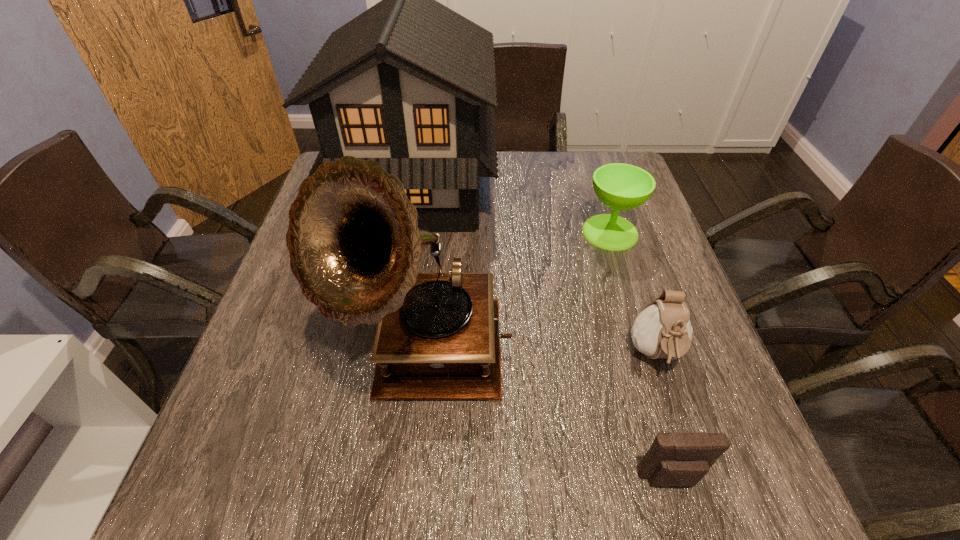
Identify which object is located as the nearest to the farther pouch. Please provide its 2D coordinates. Your answer should be formatted as a tuple, i.e. [(x, y)], where the tuple contains the x and y coordinates of a point satisfying the conditions above.

[(678, 458)]

The width and height of the screenshot is (960, 540). Find the location of `object that is the fourth closest to the farther pouch`. object that is the fourth closest to the farther pouch is located at coordinates (409, 83).